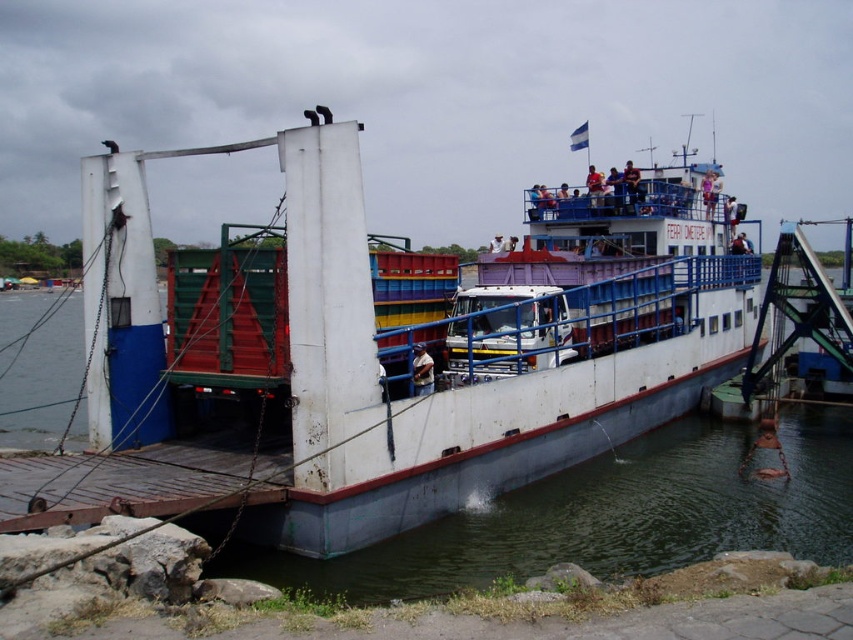
Question: Which point is closer to the camera?

Choices:
 (A) light brown leather jacket at center
 (B) light blue fabric shirt at upper center
 (C) white matte boat at center

Answer: (C)

Question: Does white matte boat at center appear over light brown leather jacket at center?

Choices:
 (A) no
 (B) yes

Answer: (B)

Question: Can you confirm if white matte boat at center is bigger than light blue fabric shirt at upper center?

Choices:
 (A) yes
 (B) no

Answer: (A)

Question: Which point is farther from the camera taking this photo?

Choices:
 (A) pyautogui.click(x=718, y=188)
 (B) pyautogui.click(x=135, y=513)

Answer: (A)

Question: Observing the image, what is the correct spatial positioning of white matte boat at center in reference to light blue fabric shirt at upper center?

Choices:
 (A) left
 (B) right

Answer: (A)

Question: Which point is farther from the camera taking this photo?

Choices:
 (A) (538, 333)
 (B) (714, 193)

Answer: (B)